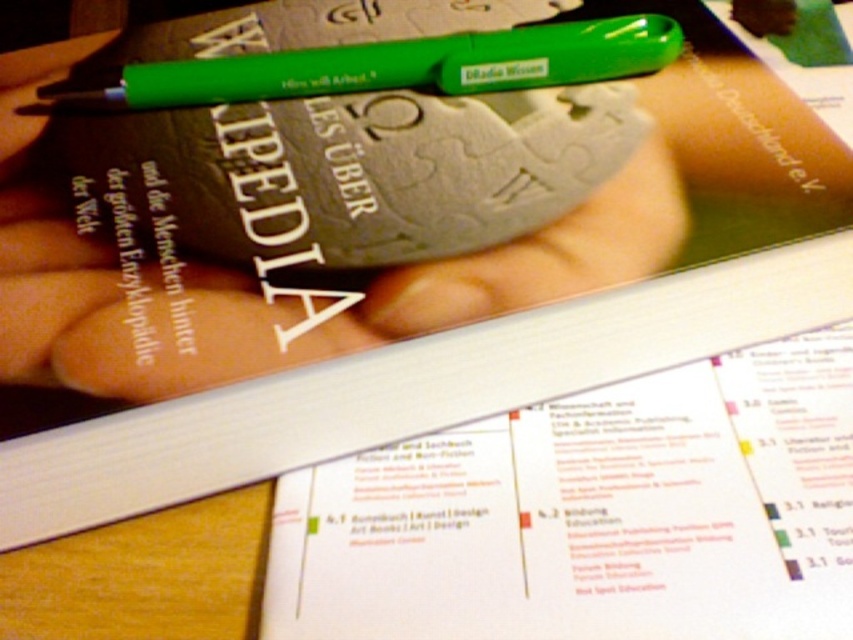
Who is shorter, green matte pen at upper center or green plastic pen at upper center?

With less height is green plastic pen at upper center.

This screenshot has width=853, height=640. Find the location of `green matte pen at upper center`. green matte pen at upper center is located at coordinates (254, 282).